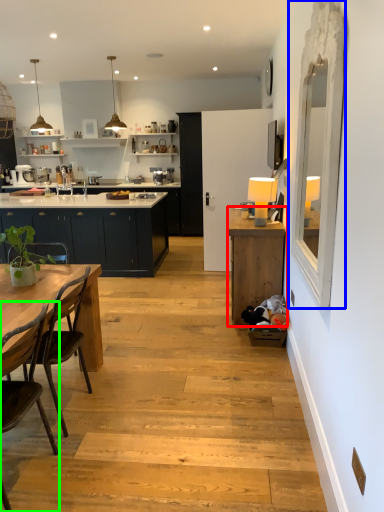
Question: Which object is positioned closest to cabinetry (highlighted by a red box)? Select from glass door (highlighted by a blue box) and chair (highlighted by a green box).

Choices:
 (A) glass door
 (B) chair

Answer: (A)